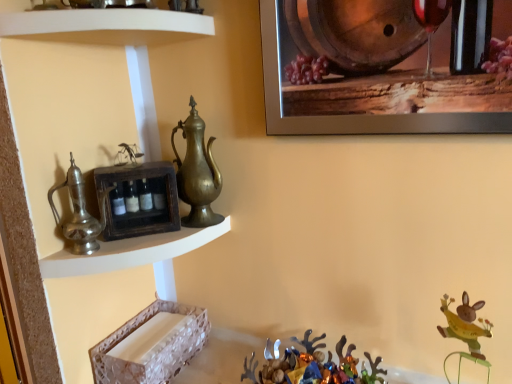
Question: Does brass/bronze jug at center, the 2th jug viewed from the front, appear on the left side of brushed metal jug at left, placed as the 2th jug when sorted from right to left?

Choices:
 (A) no
 (B) yes

Answer: (A)

Question: From the image's perspective, does brass/bronze jug at center, the 2th jug viewed from the front, appear lower than brushed metal jug at left, acting as the 1th jug starting from the left?

Choices:
 (A) yes
 (B) no

Answer: (B)

Question: Does brass/bronze jug at center, the 2th jug viewed from the front, have a lesser height compared to brushed metal jug at left, placed as the first jug when sorted from front to back?

Choices:
 (A) no
 (B) yes

Answer: (A)

Question: From the image's perspective, would you say brass/bronze jug at center, placed as the first jug when sorted from back to front, is positioned over brushed metal jug at left, placed as the first jug when sorted from front to back?

Choices:
 (A) yes
 (B) no

Answer: (A)

Question: From a real-world perspective, is brass/bronze jug at center, the 2th jug viewed from the front, below brushed metal jug at left, placed as the first jug when sorted from front to back?

Choices:
 (A) no
 (B) yes

Answer: (A)

Question: Is brass/bronze jug at center, acting as the first jug starting from the right, oriented towards brushed metal jug at left, placed as the 2th jug when sorted from right to left?

Choices:
 (A) no
 (B) yes

Answer: (A)

Question: Can you confirm if metallic silver reindeer at lower center is thinner than wooden barrel at upper right?

Choices:
 (A) yes
 (B) no

Answer: (B)

Question: Would you say metallic silver reindeer at lower center is outside wooden barrel at upper right?

Choices:
 (A) no
 (B) yes

Answer: (B)

Question: From the image's perspective, is metallic silver reindeer at lower center under wooden barrel at upper right?

Choices:
 (A) yes
 (B) no

Answer: (A)

Question: Is the position of metallic silver reindeer at lower center more distant than that of wooden barrel at upper right?

Choices:
 (A) no
 (B) yes

Answer: (B)

Question: From the image's perspective, is metallic silver reindeer at lower center above wooden barrel at upper right?

Choices:
 (A) yes
 (B) no

Answer: (B)

Question: Is metallic silver reindeer at lower center far away from wooden barrel at upper right?

Choices:
 (A) yes
 (B) no

Answer: (B)

Question: Does white glossy shelf at upper left, which is the first shelf from top to bottom, appear on the left side of white textured tray at lower left, the 1th shelf positioned from the bottom?

Choices:
 (A) yes
 (B) no

Answer: (A)